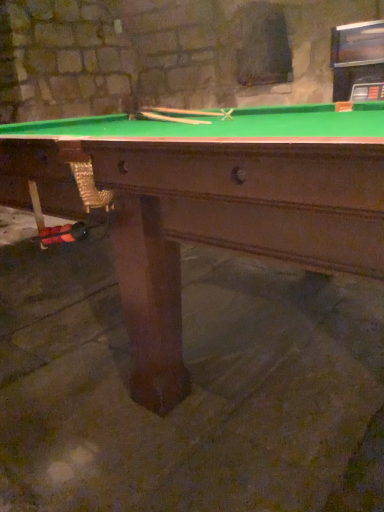
Find the location of a particular element. The height and width of the screenshot is (512, 384). wooden cue at center, the second cue ordered from the bottom is located at coordinates (187, 111).

This screenshot has height=512, width=384. Describe the element at coordinates (205, 204) in the screenshot. I see `green felt pool table at center` at that location.

From the picture: Measure the distance between point (x=376, y=129) and camera.

The distance of point (x=376, y=129) from camera is 1.30 meters.

The width and height of the screenshot is (384, 512). What do you see at coordinates (172, 118) in the screenshot?
I see `wooden cue at center, which ranks as the 2th cue in top-to-bottom order` at bounding box center [172, 118].

In order to click on wooden cue at center, the first cue in the top-to-bottom sequence in this screenshot , I will do `click(187, 111)`.

From the image's perspective, would you say wooden cue at center, the second cue ordered from the bottom, is positioned over wooden cue at center, which ranks as the 2th cue in top-to-bottom order?

Indeed, from the image's perspective, wooden cue at center, the second cue ordered from the bottom, is shown above wooden cue at center, which ranks as the 2th cue in top-to-bottom order.

Consider the image. Is wooden cue at center, the second cue ordered from the bottom, inside or outside of wooden cue at center, which ranks as the 2th cue in top-to-bottom order?

wooden cue at center, the second cue ordered from the bottom, is not enclosed by wooden cue at center, which ranks as the 2th cue in top-to-bottom order.

From a real-world perspective, who is located higher, wooden cue at center, the second cue ordered from the bottom, or wooden cue at center, which ranks as the 2th cue in top-to-bottom order?

In real-world perspective, wooden cue at center, the second cue ordered from the bottom, is above.

Between wooden cue at center, the first cue in the top-to-bottom sequence, and wooden cue at center, the first cue when ordered from bottom to top, which one appears on the right side from the viewer's perspective?

Positioned to the right is wooden cue at center, the first cue in the top-to-bottom sequence.

Considering the sizes of objects wooden cue at center, the first cue when ordered from bottom to top, and wooden cue at center, the second cue ordered from the bottom, in the image provided, who is thinner, wooden cue at center, the first cue when ordered from bottom to top, or wooden cue at center, the second cue ordered from the bottom,?

wooden cue at center, the first cue when ordered from bottom to top.

How different are the orientations of wooden cue at center, the first cue when ordered from bottom to top, and wooden cue at center, the second cue ordered from the bottom, in degrees?

The angular difference between wooden cue at center, the first cue when ordered from bottom to top, and wooden cue at center, the second cue ordered from the bottom, is 2.21 degrees.

Which is in front, wooden cue at center, the first cue when ordered from bottom to top, or wooden cue at center, the first cue in the top-to-bottom sequence?

wooden cue at center, the first cue when ordered from bottom to top, is in front.

From the image's perspective, is wooden cue at center, which ranks as the 2th cue in top-to-bottom order, located above or below green felt pool table at center?

wooden cue at center, which ranks as the 2th cue in top-to-bottom order, is situated higher than green felt pool table at center in the image.

Considering the sizes of objects wooden cue at center, which ranks as the 2th cue in top-to-bottom order, and green felt pool table at center in the image provided, who is shorter, wooden cue at center, which ranks as the 2th cue in top-to-bottom order, or green felt pool table at center?

With less height is wooden cue at center, which ranks as the 2th cue in top-to-bottom order.

Does wooden cue at center, the first cue when ordered from bottom to top, come behind green felt pool table at center?

Yes, wooden cue at center, the first cue when ordered from bottom to top, is behind green felt pool table at center.

Considering the sizes of objects wooden cue at center, the first cue when ordered from bottom to top, and green felt pool table at center in the image provided, who is bigger, wooden cue at center, the first cue when ordered from bottom to top, or green felt pool table at center?

With larger size is green felt pool table at center.

From the picture: Is the surface of wooden cue at center, the first cue in the top-to-bottom sequence, in direct contact with green felt pool table at center?

wooden cue at center, the first cue in the top-to-bottom sequence, is not next to green felt pool table at center, and they're not touching.

Is wooden cue at center, the first cue in the top-to-bottom sequence, positioned with its back to green felt pool table at center?

Yes, wooden cue at center, the first cue in the top-to-bottom sequence, is facing away from green felt pool table at center.

Is wooden cue at center, the second cue ordered from the bottom, positioned in front of green felt pool table at center?

No, wooden cue at center, the second cue ordered from the bottom, is further to the viewer.

Is point (223, 114) positioned after point (89, 185)?

Yes.

Which point is more distant from viewer, (51, 172) or (185, 119)?

Point (185, 119)

From a real-world perspective, which is physically above, green felt pool table at center or wooden cue at center, which ranks as the 2th cue in top-to-bottom order?

wooden cue at center, which ranks as the 2th cue in top-to-bottom order.

Is green felt pool table at center positioned far away from wooden cue at center, which ranks as the 2th cue in top-to-bottom order?

That's not correct — green felt pool table at center is a little close to wooden cue at center, which ranks as the 2th cue in top-to-bottom order.

Considering the relative sizes of green felt pool table at center and wooden cue at center, which ranks as the 2th cue in top-to-bottom order, in the image provided, is green felt pool table at center shorter than wooden cue at center, which ranks as the 2th cue in top-to-bottom order,?

Incorrect, the height of green felt pool table at center does not fall short of that of wooden cue at center, which ranks as the 2th cue in top-to-bottom order.

In the image, is green felt pool table at center positioned in front of or behind wooden cue at center, the first cue in the top-to-bottom sequence?

green felt pool table at center is in front of wooden cue at center, the first cue in the top-to-bottom sequence.

From the image's perspective, would you say green felt pool table at center is positioned over wooden cue at center, the second cue ordered from the bottom?

No.

Locate an element on the screen. Image resolution: width=384 pixels, height=512 pixels. billiard table lying in front of the wooden cue at center, the first cue in the top-to-bottom sequence is located at coordinates (205, 204).

Is green felt pool table at center oriented away from wooden cue at center, the first cue in the top-to-bottom sequence?

No, green felt pool table at center's orientation is not away from wooden cue at center, the first cue in the top-to-bottom sequence.

What are the coordinates of `cue lying above the wooden cue at center, which ranks as the 2th cue in top-to-bottom order (from the image's perspective)` in the screenshot? It's located at (187, 111).

Find the location of a particular element. cue on the right of the wooden cue at center, which ranks as the 2th cue in top-to-bottom order is located at coordinates (187, 111).

When comparing their distances from wooden cue at center, the first cue when ordered from bottom to top, does green felt pool table at center or wooden cue at center, the first cue in the top-to-bottom sequence, seem closer?

The object closer to wooden cue at center, the first cue when ordered from bottom to top, is green felt pool table at center.

When comparing their distances from green felt pool table at center, does wooden cue at center, the first cue in the top-to-bottom sequence, or wooden cue at center, which ranks as the 2th cue in top-to-bottom order, seem closer?

The object closer to green felt pool table at center is wooden cue at center, which ranks as the 2th cue in top-to-bottom order.

When comparing their distances from wooden cue at center, which ranks as the 2th cue in top-to-bottom order, does wooden cue at center, the second cue ordered from the bottom, or green felt pool table at center seem closer?

The object closer to wooden cue at center, which ranks as the 2th cue in top-to-bottom order, is green felt pool table at center.

From the image, which object appears to be farther from green felt pool table at center, wooden cue at center, the first cue when ordered from bottom to top, or wooden cue at center, the second cue ordered from the bottom?

Based on the image, wooden cue at center, the second cue ordered from the bottom, appears to be further to green felt pool table at center.

Based on their spatial positions, is green felt pool table at center or wooden cue at center, the first cue when ordered from bottom to top, closer to wooden cue at center, the second cue ordered from the bottom?

wooden cue at center, the first cue when ordered from bottom to top.

Estimate the real-world distances between objects in this image. Which object is closer to wooden cue at center, the second cue ordered from the bottom, wooden cue at center, the first cue when ordered from bottom to top, or green felt pool table at center?

wooden cue at center, the first cue when ordered from bottom to top, is closer to wooden cue at center, the second cue ordered from the bottom.

The height and width of the screenshot is (512, 384). Identify the location of cue between green felt pool table at center and wooden cue at center, the second cue ordered from the bottom, along the z-axis. (172, 118).